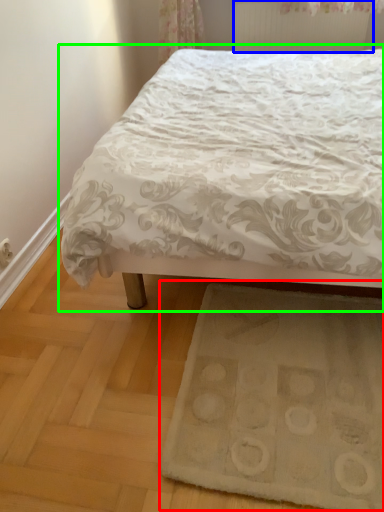
Question: Based on their relative distances, which object is farther from doormat (highlighted by a red box)? Choose from radiator (highlighted by a blue box) and bed (highlighted by a green box).

Choices:
 (A) radiator
 (B) bed

Answer: (A)